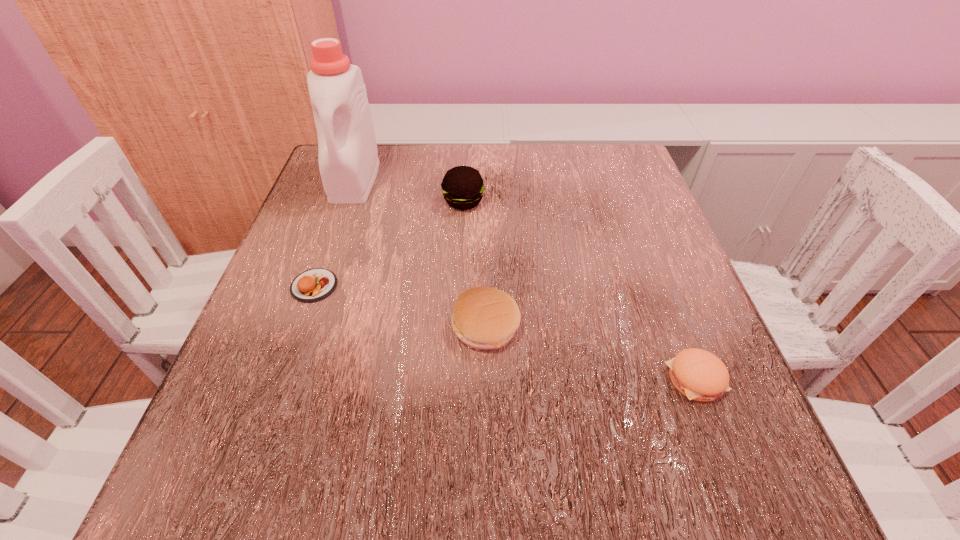
Identify the location of unoccupied position between the fourth shortest object and the tallest object. The height and width of the screenshot is (540, 960). (409, 191).

Where is `vacant area that lies between the third shortest object and the second tallest object`? The width and height of the screenshot is (960, 540). vacant area that lies between the third shortest object and the second tallest object is located at coordinates (474, 264).

Where is `vacant area that lies between the fourth shortest object and the second tallest patty (food)`? vacant area that lies between the fourth shortest object and the second tallest patty (food) is located at coordinates (474, 264).

The width and height of the screenshot is (960, 540). Identify the location of empty space that is in between the tallest patty (food) and the tallest object. (409, 191).

I want to click on free space between the second tallest object and the rightmost patty (food), so click(x=579, y=290).

Select which object appears as the closest to the tallest patty (food). Please provide its 2D coordinates. Your answer should be formatted as a tuple, i.e. [(x, y)], where the tuple contains the x and y coordinates of a point satisfying the conditions above.

[(348, 159)]

Choose which object is the second nearest neighbor to the leftmost patty (food). Please provide its 2D coordinates. Your answer should be formatted as a tuple, i.e. [(x, y)], where the tuple contains the x and y coordinates of a point satisfying the conditions above.

[(483, 317)]

Choose which patty (food) is the nearest neighbor to the rightmost patty (food). Please provide its 2D coordinates. Your answer should be formatted as a tuple, i.e. [(x, y)], where the tuple contains the x and y coordinates of a point satisfying the conditions above.

[(483, 317)]

At what (x,y) coordinates should I click in order to perform the action: click on the closest patty (food) to the rightmost object. Please return your answer as a coordinate pair (x, y). This screenshot has width=960, height=540. Looking at the image, I should click on point(483,317).

The height and width of the screenshot is (540, 960). I want to click on free location that satisfies the following two spatial constraints: 1. on the handle side of the tallest object; 2. on the right side of the third shortest patty (food), so click(x=304, y=326).